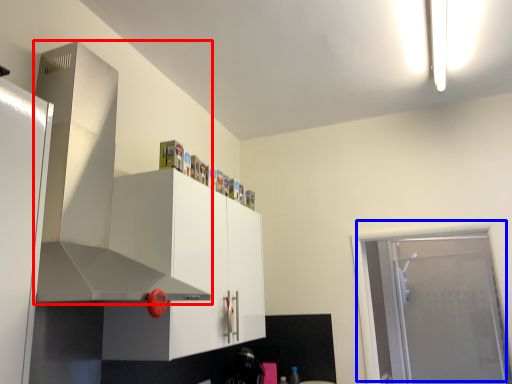
Question: Which of the following is the farthest to the observer, exhaust hood (highlighted by a red box) or door (highlighted by a blue box)?

Choices:
 (A) exhaust hood
 (B) door

Answer: (B)